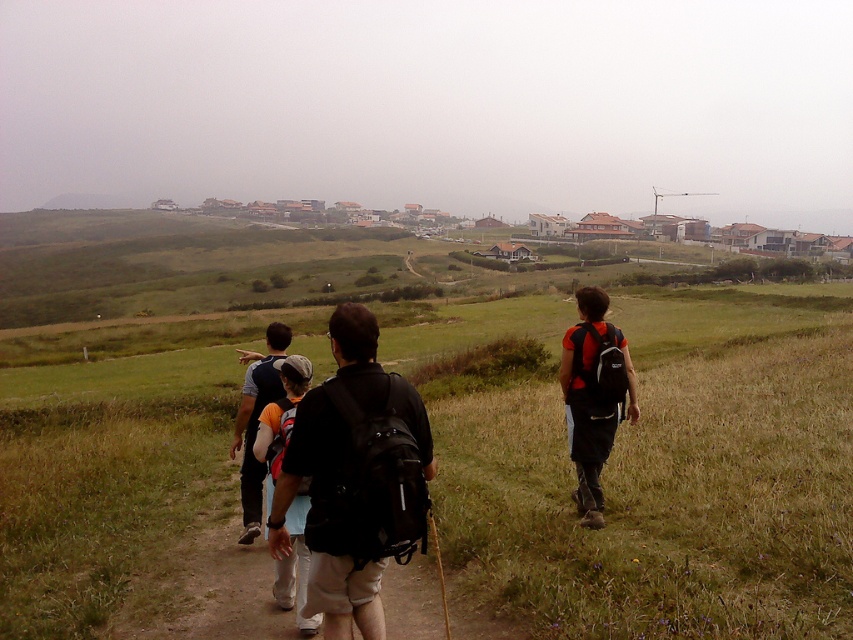
Question: Which object is closer to the camera taking this photo?

Choices:
 (A) matte black backpack at center
 (B) green grassy at center
 (C) orange fabric backpack at right
 (D) black fabric backpack at right

Answer: (A)

Question: Which of the following is the closest to the observer?

Choices:
 (A) black fabric backpack at right
 (B) matte black backpack at center
 (C) green grassy at center

Answer: (B)

Question: Which is nearer to the black backpack at center?

Choices:
 (A) orange fabric backpack at right
 (B) black fabric backpack at right
 (C) matte black backpack at center

Answer: (C)

Question: Can you confirm if orange fabric backpack at right is bigger than black fabric backpack at right?

Choices:
 (A) yes
 (B) no

Answer: (A)

Question: Is green grassy at center below orange fabric backpack at right?

Choices:
 (A) no
 (B) yes

Answer: (B)

Question: Does green grassy at center have a larger size compared to orange fabric backpack at center?

Choices:
 (A) no
 (B) yes

Answer: (B)